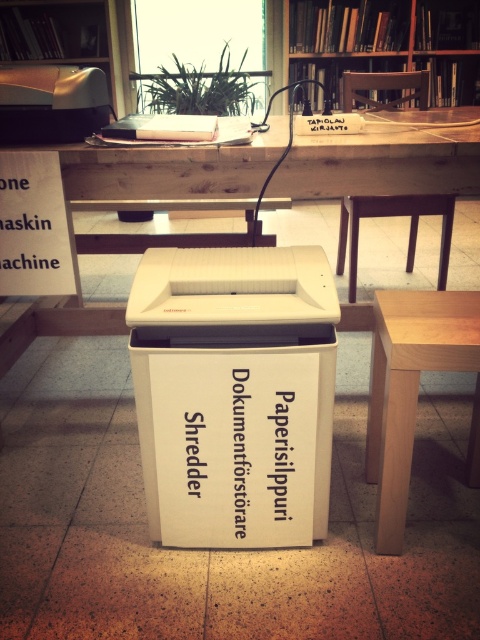
Which is more to the right, white plastic table at center or wooden bookshelf at upper center?

wooden bookshelf at upper center

Which is above, white plastic table at center or wooden bookshelf at upper center?

wooden bookshelf at upper center

Find the location of `white plastic table at center`. white plastic table at center is located at coordinates (x=385, y=160).

Does point (460, 192) lie behind point (479, 397)?

That is True.

Is white plastic table at center bigger than light brown wooden table at center?

Yes.

The height and width of the screenshot is (640, 480). What do you see at coordinates (385, 160) in the screenshot? I see `white plastic table at center` at bounding box center [385, 160].

Identify the location of white plastic table at center. The height and width of the screenshot is (640, 480). (385, 160).

Between light brown wooden table at center and wooden bookshelf at upper center, which one has more height?

wooden bookshelf at upper center is taller.

Is point (399, 470) closer to viewer compared to point (479, 42)?

Yes.

I want to click on light brown wooden table at center, so click(x=414, y=388).